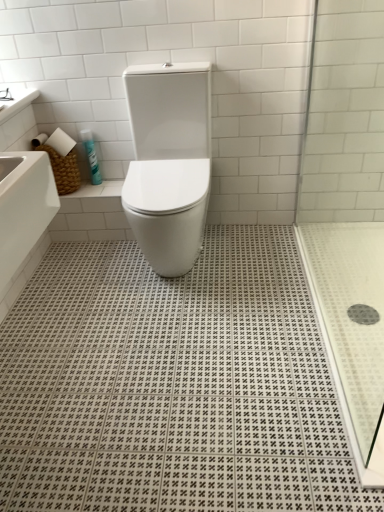
Question: From their relative heights in the image, would you say white glossy toilet at center is taller or shorter than transparent glass shower door at right?

Choices:
 (A) short
 (B) tall

Answer: (A)

Question: In terms of size, does white glossy toilet at center appear bigger or smaller than transparent glass shower door at right?

Choices:
 (A) big
 (B) small

Answer: (A)

Question: Which is farther from the white glossy countertop at upper left?

Choices:
 (A) white glossy toilet at center
 (B) black rubber drain at lower right
 (C) blue glossy spray can at upper left
 (D) transparent glass shower door at right

Answer: (B)

Question: Estimate the real-world distances between objects in this image. Which object is farther from the transparent glass shower door at right?

Choices:
 (A) blue glossy spray can at upper left
 (B) white glossy toilet at center
 (C) white glossy countertop at upper left
 (D) black rubber drain at lower right

Answer: (C)